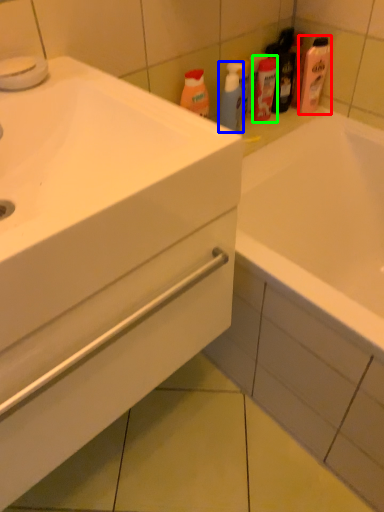
Question: Which is nearer to the cleaning product (highlighted by a red box)? cleaning product (highlighted by a blue box) or mouthwash (highlighted by a green box).

Choices:
 (A) cleaning product
 (B) mouthwash

Answer: (B)